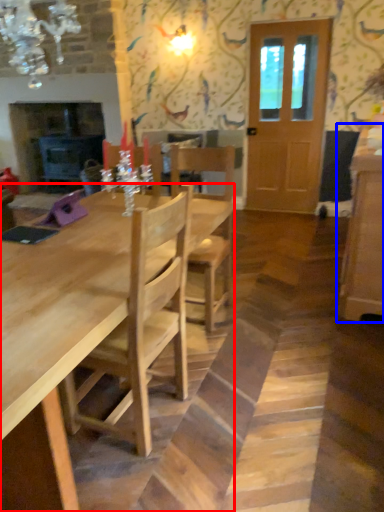
Question: Among these objects, which one is farthest to the camera, kitchen & dining room table (highlighted by a red box) or cabinetry (highlighted by a blue box)?

Choices:
 (A) kitchen & dining room table
 (B) cabinetry

Answer: (B)